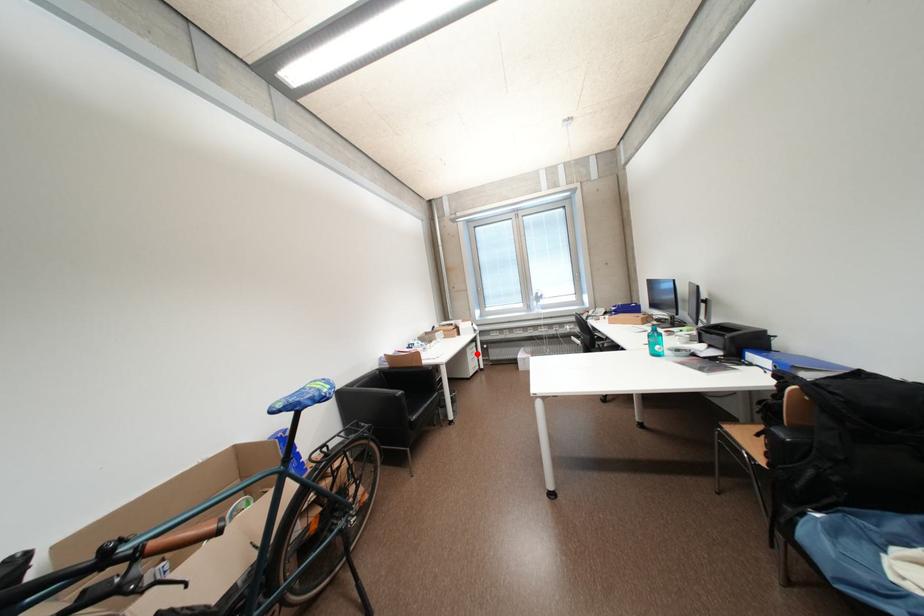
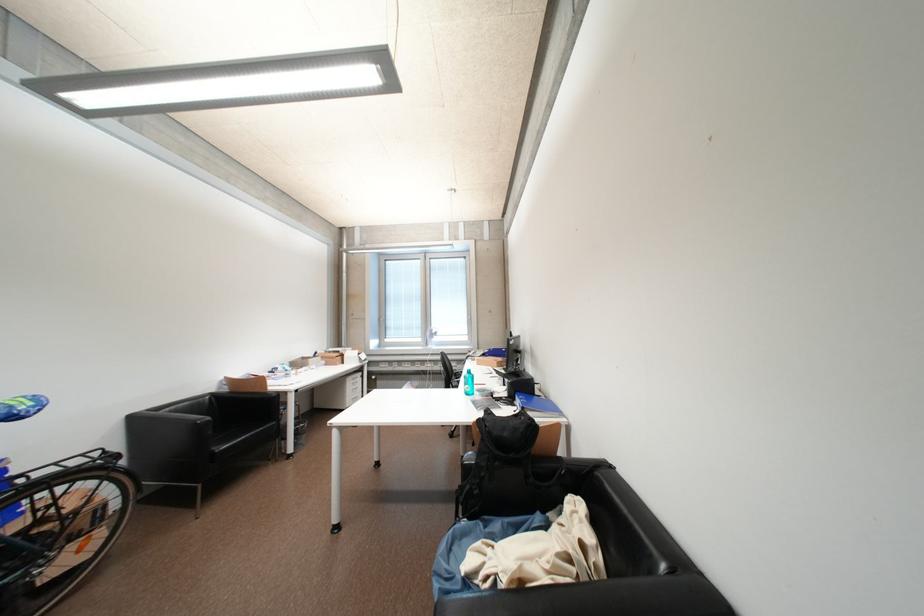
In the second image, find the point that corresponds to the highlighted location in the first image.

(358, 384)